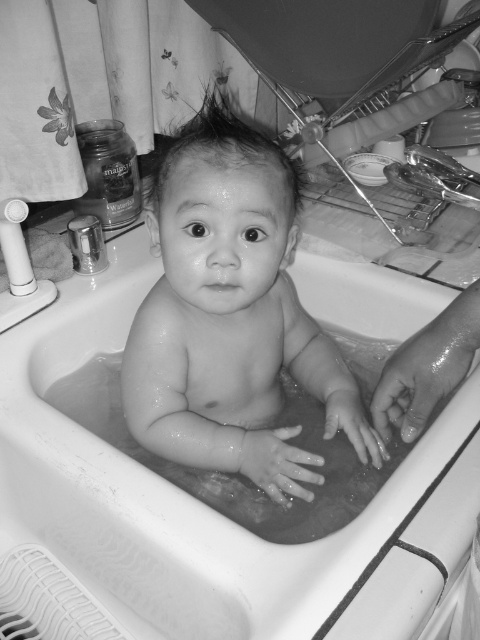
Question: Is white smooth bathtub at center above wet skin hand at lower right?

Choices:
 (A) yes
 (B) no

Answer: (B)

Question: Is white smooth bathtub at center closer to camera compared to smooth skin hand at center?

Choices:
 (A) yes
 (B) no

Answer: (A)

Question: In this image, where is wet skin hand at lower right located relative to wet skin hand at center?

Choices:
 (A) above
 (B) below

Answer: (A)

Question: Which object is closer to the camera taking this photo?

Choices:
 (A) wet skin baby at center
 (B) smooth skin hand at center
 (C) white smooth bathtub at center
 (D) wet skin hand at lower right

Answer: (C)

Question: Which of the following is the closest to the observer?

Choices:
 (A) wet skin hand at center
 (B) smooth skin hand at center
 (C) wet skin baby at center
 (D) white smooth bathtub at center

Answer: (D)

Question: Which point appears closest to the camera in this image?

Choices:
 (A) (238, 196)
 (B) (448, 392)
 (C) (469, 394)
 (D) (254, 442)

Answer: (A)